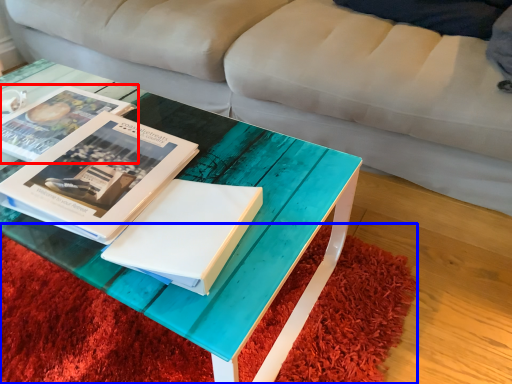
Question: Which object is further to the camera taking this photo, book (highlighted by a red box) or mat (highlighted by a blue box)?

Choices:
 (A) book
 (B) mat

Answer: (A)